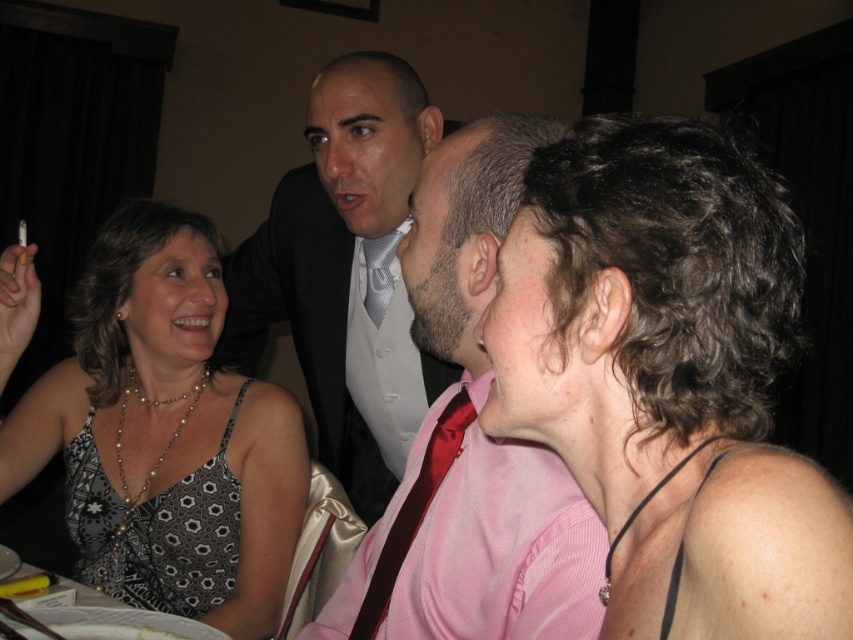
Does dark curly hair at upper right have a lesser width compared to black printed fabric dress at lower left?

Correct, dark curly hair at upper right's width is less than black printed fabric dress at lower left's.

Can you confirm if dark curly hair at upper right is positioned to the right of black printed fabric dress at lower left?

Correct, you'll find dark curly hair at upper right to the right of black printed fabric dress at lower left.

Is point (670, 227) farther from viewer compared to point (173, 579)?

No, it is not.

Where is `dark curly hair at upper right`? dark curly hair at upper right is located at coordinates click(x=669, y=378).

Who is higher up, patterned fabric dress at left or shiny red tie at center?

Positioned higher is patterned fabric dress at left.

Does point (210, 268) lie in front of point (468, 403)?

No.

Describe the element at coordinates (165, 435) in the screenshot. I see `patterned fabric dress at left` at that location.

The image size is (853, 640). What are the coordinates of `patterned fabric dress at left` in the screenshot? It's located at (165, 435).

Is matte black suit at center to the right of black printed fabric dress at lower left from the viewer's perspective?

Indeed, matte black suit at center is positioned on the right side of black printed fabric dress at lower left.

Does matte black suit at center have a lesser height compared to black printed fabric dress at lower left?

No.

Is point (596, 522) positioned after point (231, 541)?

That is False.

Where is `matte black suit at center`? matte black suit at center is located at coordinates (469, 442).